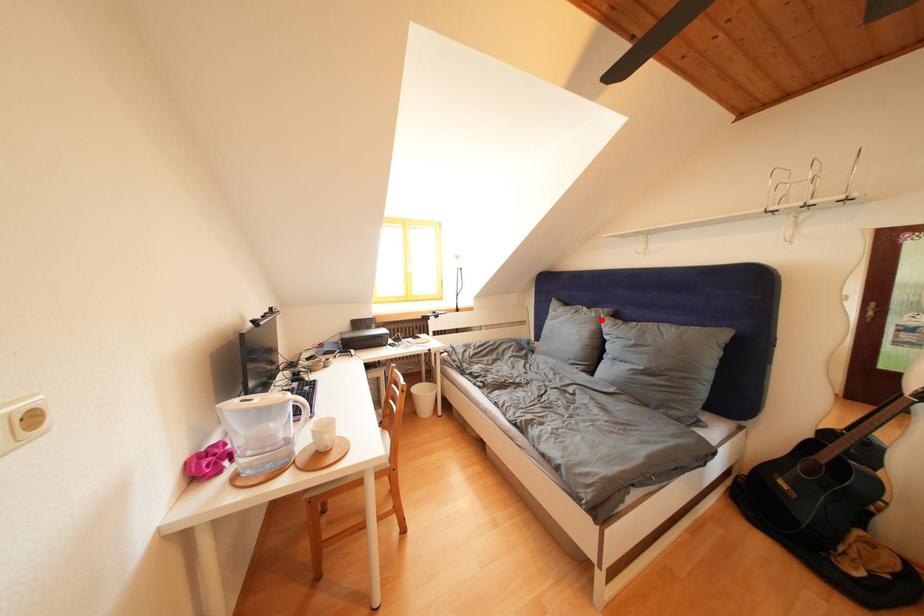
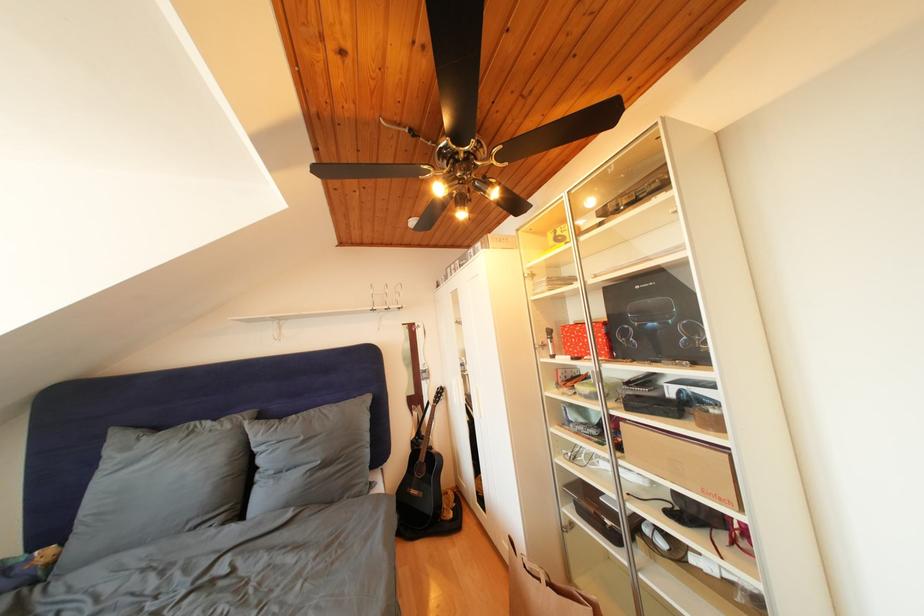
In the second image, find the point that corresponds to the highlighted location in the first image.

(236, 432)